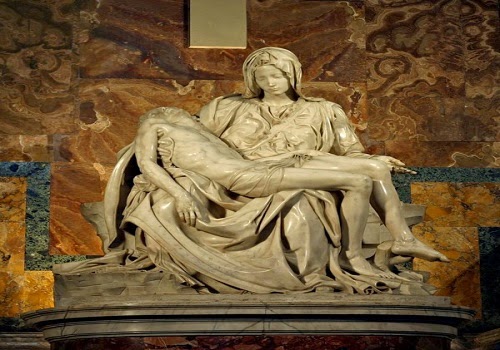
What are the coordinates of `statue pedestal` in the screenshot? It's located at (313, 302).